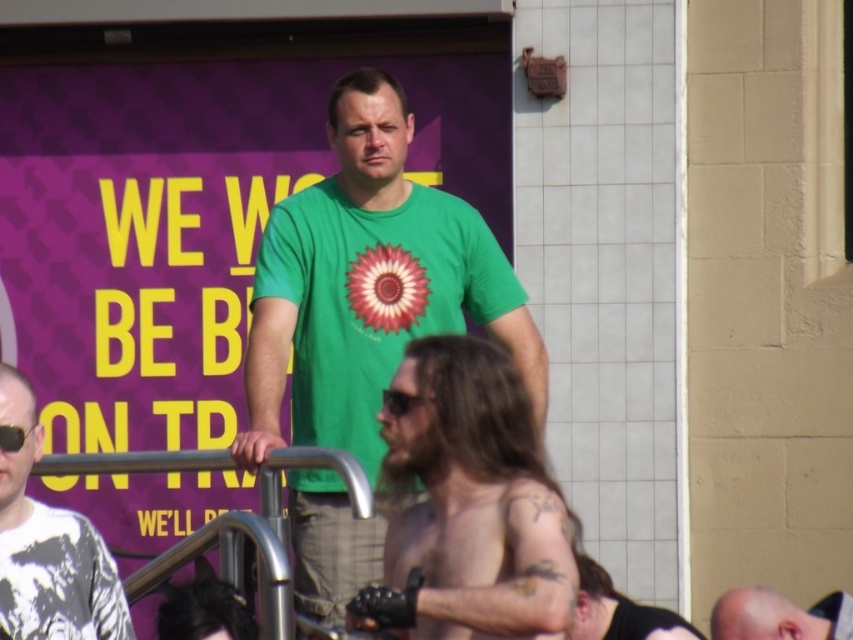
You are a photographer trying to capture a closeup of the shiny leather glove at center without including the shiny black leather glove at lower center in the frame. Based on their positions, is this possible?

The shiny leather glove at center is in front of the shiny black leather glove at lower center, so it is possible to capture a closeup of the shiny leather glove at center without including the shiny black leather glove at lower center in the frame by focusing on the foreground object.